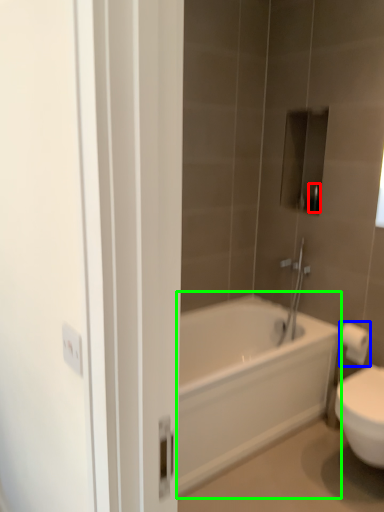
Question: Considering the real-world distances, which object is closest to toiletry (highlighted by a red box)? toilet paper (highlighted by a blue box) or bathtub (highlighted by a green box).

Choices:
 (A) toilet paper
 (B) bathtub

Answer: (A)